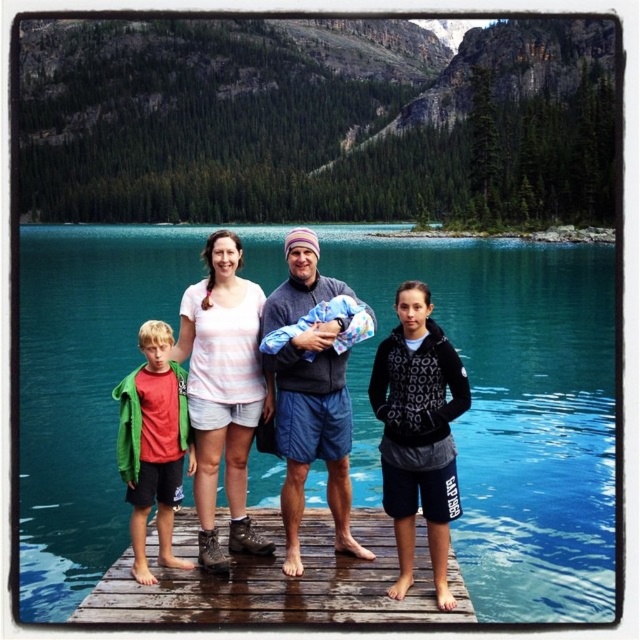
You are standing at point (180, 337) and want to walk to point (52, 170). Is there any obstruction between you and your destination?

Point (52, 170) is behind point (180, 337), so there is an obstruction between you and your destination.

You are a photographer trying to capture the family on the dock. You notice the brown wooden dock at center and the red cotton shirt at left. Which object is located to the right of the other?

The brown wooden dock at center is positioned on the right side of red cotton shirt at left.

You are a photographer standing on the brown wooden dock at center and want to take a photo of the red cotton shirt at left. Since the dock is lower than the shirt, will you need to look up or down to frame the shirt in your camera?

The brown wooden dock at center has a lesser height compared to red cotton shirt at left, so you will need to look up to frame the red cotton shirt at left in your camera.